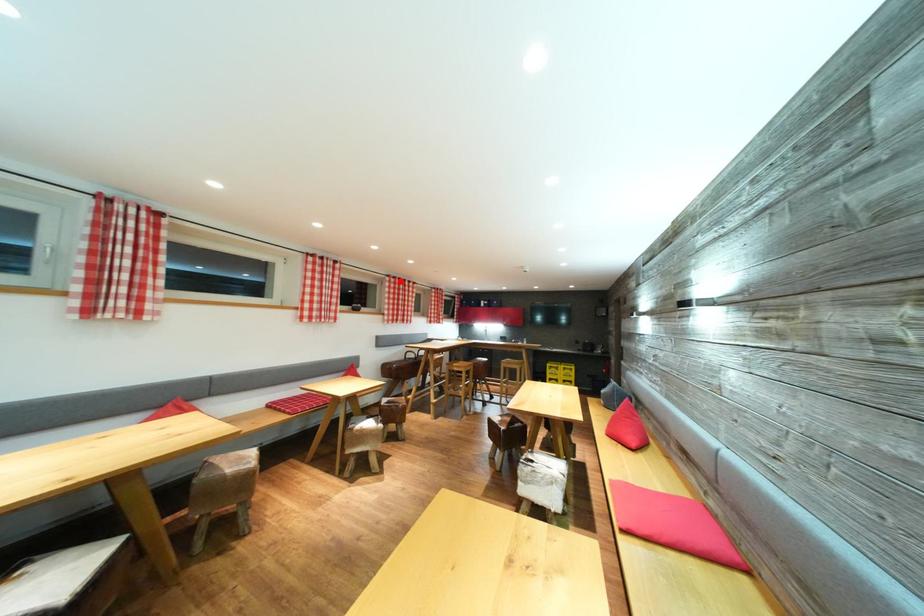
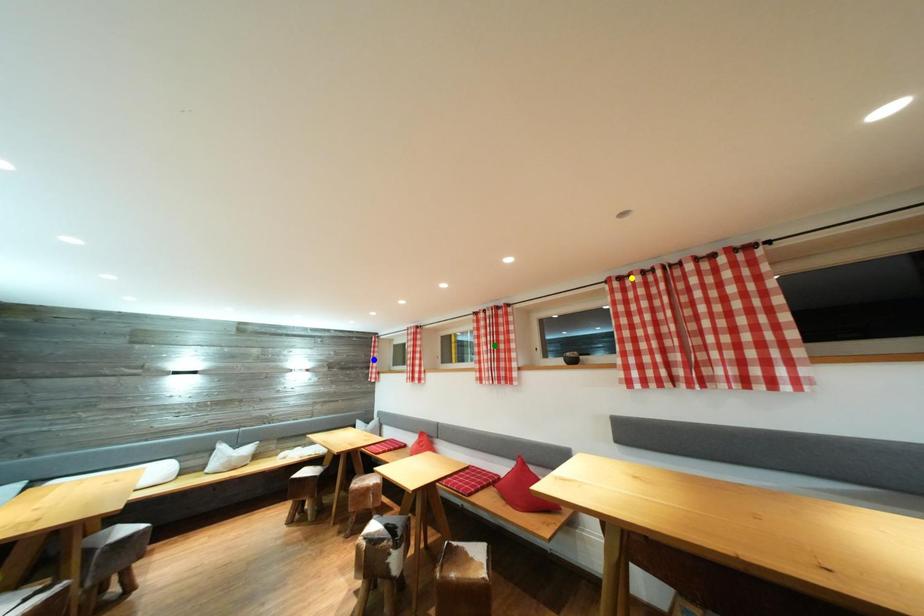
Question: I am providing you with two images of the same scene from different viewpoints. A red point is marked on the first image. You are given multiple points on the second image. In image 2, which mark is for the same physical point as the one in image 1?

Choices:
 (A) yellow point
 (B) blue point
 (C) green point

Answer: (A)